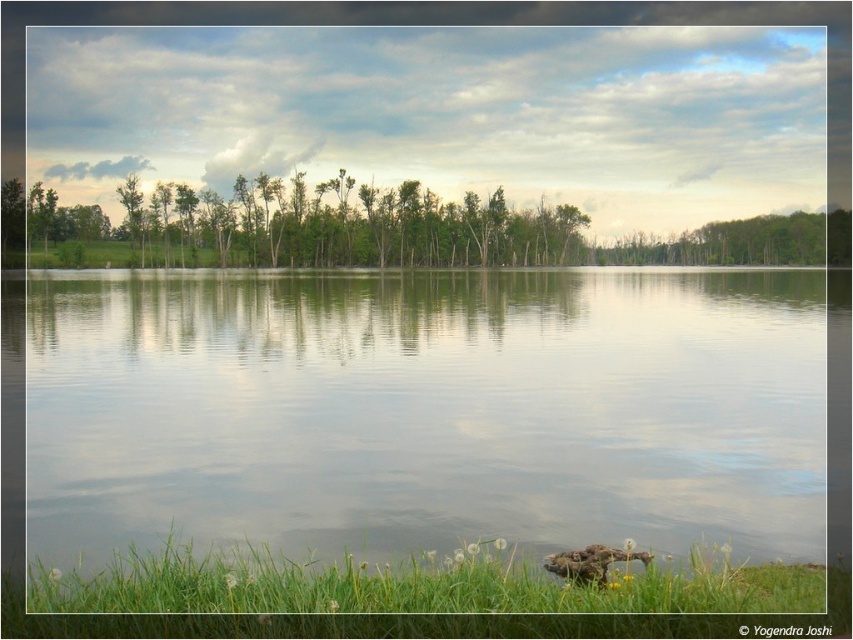
Question: Does green grass at lower center have a greater width compared to brown fuzzy duck at lower center?

Choices:
 (A) no
 (B) yes

Answer: (B)

Question: Can you confirm if clear water at center is positioned above green grass at lower center?

Choices:
 (A) no
 (B) yes

Answer: (B)

Question: Estimate the real-world distances between objects in this image. Which object is farther from the brown fuzzy duck at lower center?

Choices:
 (A) green grass at lower center
 (B) clear water at center

Answer: (B)

Question: Which object appears closest to the camera in this image?

Choices:
 (A) green grass at lower center
 (B) brown fuzzy duck at lower center

Answer: (A)

Question: Which of the following is the closest to the observer?

Choices:
 (A) (543, 564)
 (B) (630, 456)
 (C) (325, 600)

Answer: (C)

Question: Is clear water at center further to camera compared to brown fuzzy duck at lower center?

Choices:
 (A) yes
 (B) no

Answer: (A)